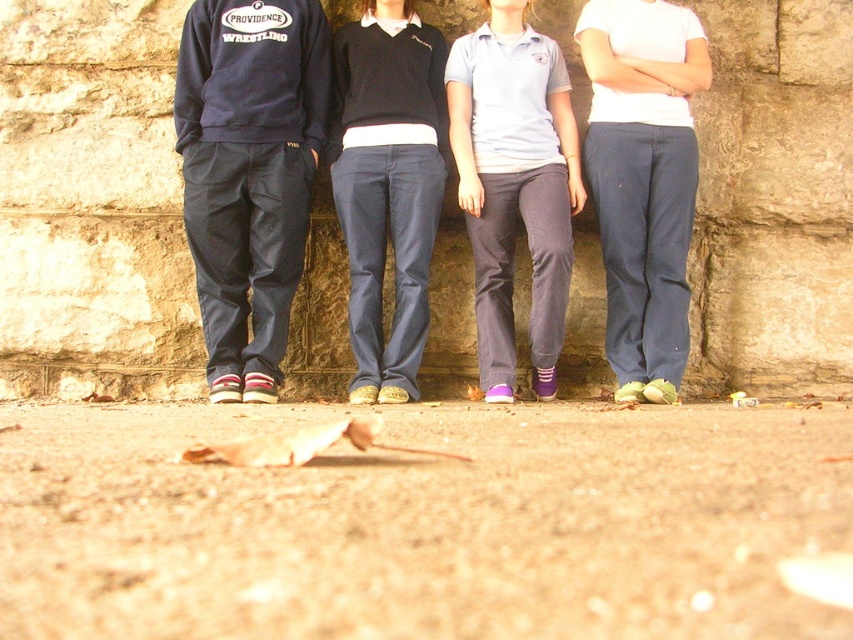
Based on the scene description, can you determine which object is wider between the stone at center and the gray cotton pants at center?

The stone at center is wider than the gray cotton pants at center according to the description.

You are standing at the camera position and want to hand a pair of white cotton pants to someone. Which individual is wearing the white cotton pants at center?

The second individual from the left is wearing the white cotton pants at center.